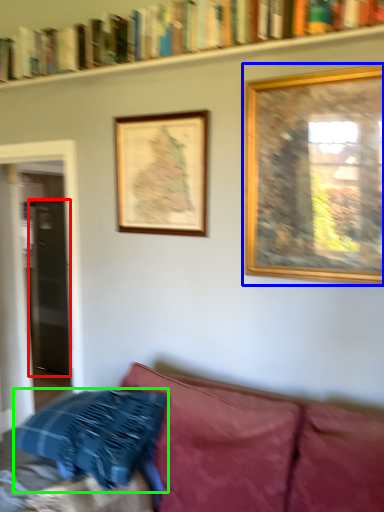
Question: Which object is the farthest from glass door (highlighted by a red box)? Choose among these: picture frame (highlighted by a blue box) or pillow (highlighted by a green box).

Choices:
 (A) picture frame
 (B) pillow

Answer: (A)